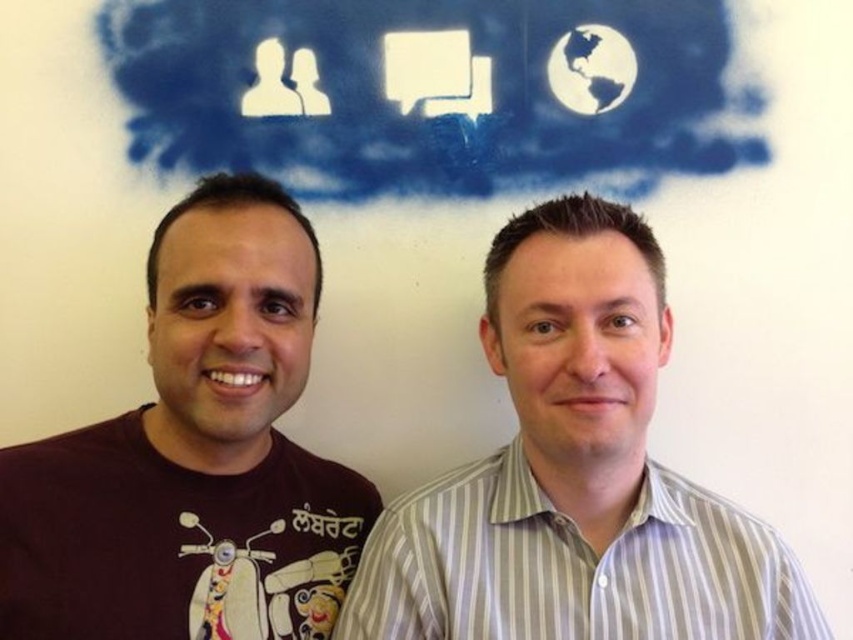
Question: Does white paper cloud at upper center have a larger size compared to white striped shirt at center?

Choices:
 (A) no
 (B) yes

Answer: (A)

Question: Does white paper cloud at upper center come in front of white striped shirt at center?

Choices:
 (A) no
 (B) yes

Answer: (A)

Question: Which point is closer to the camera?

Choices:
 (A) pos(358,157)
 (B) pos(550,492)

Answer: (B)

Question: Which point is closer to the camera?

Choices:
 (A) white striped shirt at center
 (B) white paper cloud at upper center
 (C) brown cotton t-shirt at left

Answer: (A)

Question: Estimate the real-world distances between objects in this image. Which object is farther from the white paper cloud at upper center?

Choices:
 (A) brown cotton t-shirt at left
 (B) white striped shirt at center

Answer: (B)

Question: Considering the relative positions of white paper cloud at upper center and brown cotton t-shirt at left in the image provided, where is white paper cloud at upper center located with respect to brown cotton t-shirt at left?

Choices:
 (A) above
 (B) below

Answer: (A)